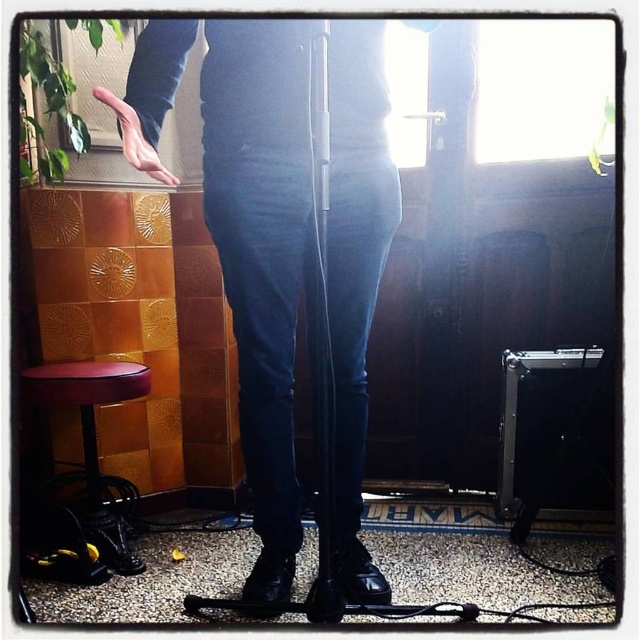
You are setting up a video call and need to position your chair so that it is directly under the microphone. The scene has a leather bar stool at lower left and a transparent plastic microphone at center. Which object should you move to achieve this?

The leather bar stool at lower left is located below the transparent plastic microphone at center. To position the chair directly under the microphone, you should move the leather bar stool at lower left to align it under the transparent plastic microphone at center.

You are a photographer standing at the camera position. You want to adjust the focus to capture the matte black boots at center clearly. What is the minimum distance you should set the focus to ensure the boots are in sharp focus?

The minimum focus distance should be set to 1.21 meters to ensure the matte black boots at center are in sharp focus since they are located 1.21 meters away from the camera.